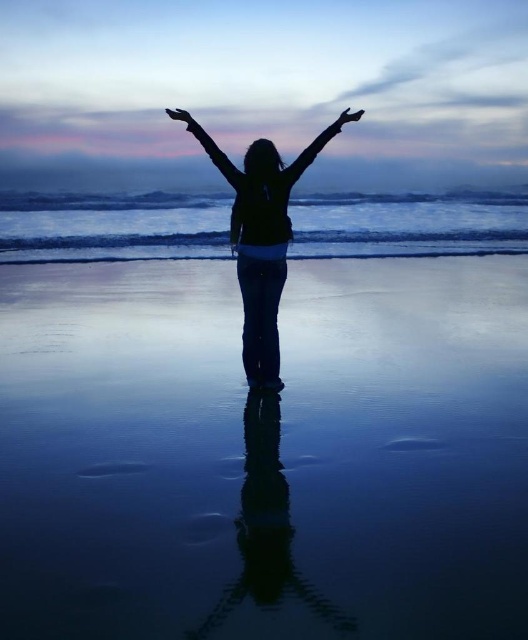
Question: Does silhouette fabric at center have a smaller size compared to black matte hand at upper right?

Choices:
 (A) yes
 (B) no

Answer: (B)

Question: Which object is the farthest from the silhouette fabric at center?

Choices:
 (A) black matte arm at center
 (B) black matte arm at upper center

Answer: (A)

Question: Estimate the real-world distances between objects in this image. Which object is closer to the black matte arm at center?

Choices:
 (A) smooth sand at center
 (B) black matte hand at upper right
 (C) clear blue water at center
 (D) silhouette fabric at center

Answer: (B)

Question: Is black matte arm at upper center wider than black matte arm at center?

Choices:
 (A) no
 (B) yes

Answer: (A)

Question: Which object appears farthest from the camera in this image?

Choices:
 (A) smooth black hand at upper center
 (B) clear blue water at center
 (C) smooth sand at center

Answer: (B)

Question: In this image, where is clear blue water at center located relative to silhouette fabric at center?

Choices:
 (A) below
 (B) above

Answer: (B)